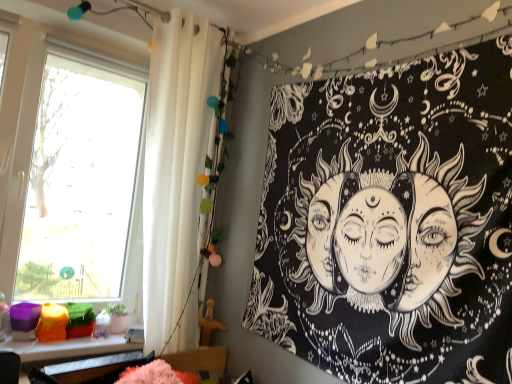
Question: From the image's perspective, is plastic colorful objects at lower left above or below black paper tapestry at upper right?

Choices:
 (A) above
 (B) below

Answer: (B)

Question: Would you say plastic colorful objects at lower left is to the left or to the right of black paper tapestry at upper right in the picture?

Choices:
 (A) left
 (B) right

Answer: (A)

Question: Which is nearer to the transparent glass window at left?

Choices:
 (A) white fabric shower curtain at left
 (B) black paper tapestry at upper right
 (C) plastic colorful objects at lower left

Answer: (A)

Question: Which of these objects is positioned closest to the transparent glass window at left?

Choices:
 (A) plastic colorful objects at lower left
 (B) black paper tapestry at upper right
 (C) white fabric shower curtain at left

Answer: (C)